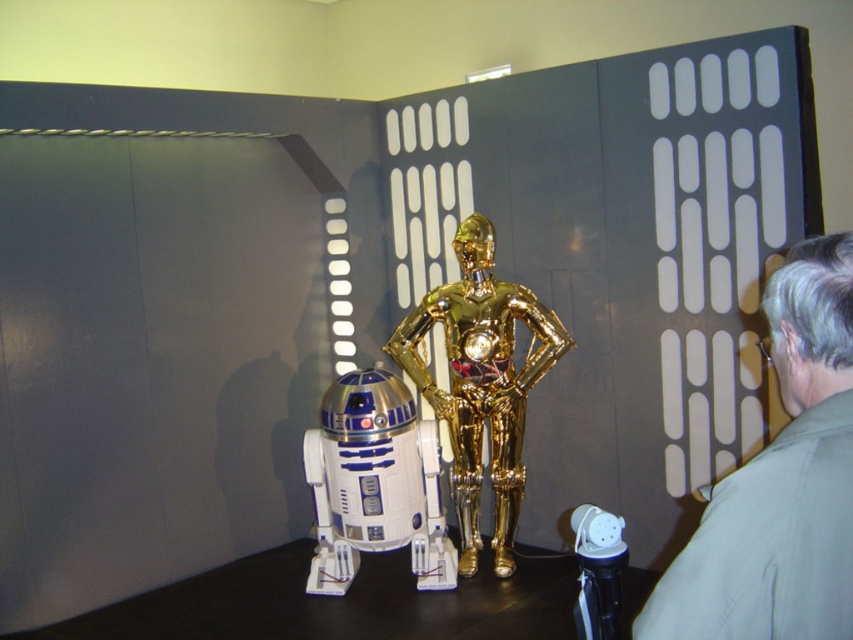
Question: Estimate the real-world distances between objects in this image. Which object is farther from the white plastic robot at center?

Choices:
 (A) gray fabric shirt at right
 (B) gold metallic robot at center

Answer: (A)

Question: Is black glossy table at lower center to the right of white plastic toy at lower right from the viewer's perspective?

Choices:
 (A) yes
 (B) no

Answer: (B)

Question: Which point appears closest to the camera in this image?

Choices:
 (A) (605, 628)
 (B) (730, 554)
 (C) (332, 541)
 (D) (492, 451)

Answer: (B)

Question: Does gray fabric shirt at right come behind gold metallic robot at center?

Choices:
 (A) no
 (B) yes

Answer: (A)

Question: Among these points, which one is nearest to the camera?

Choices:
 (A) (750, 566)
 (B) (607, 625)

Answer: (A)

Question: Does gray fabric shirt at right have a larger size compared to black glossy table at lower center?

Choices:
 (A) yes
 (B) no

Answer: (B)